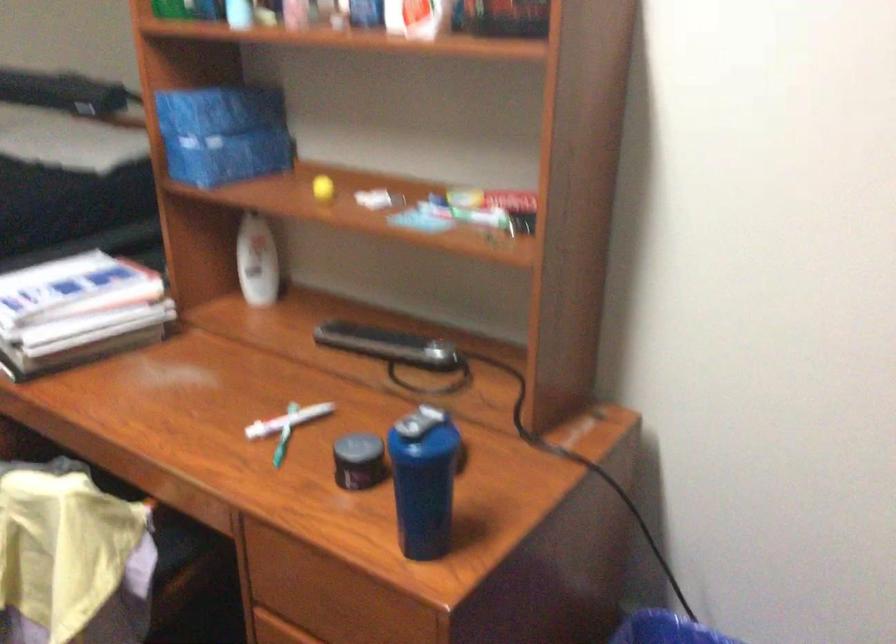
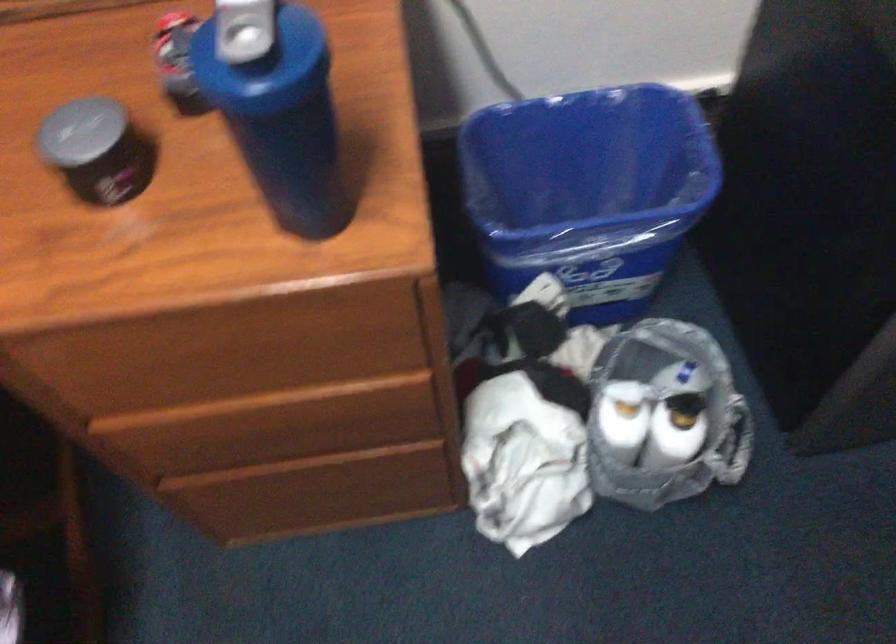
In the second image, find the point that corresponds to [354,444] in the first image.

(80, 131)